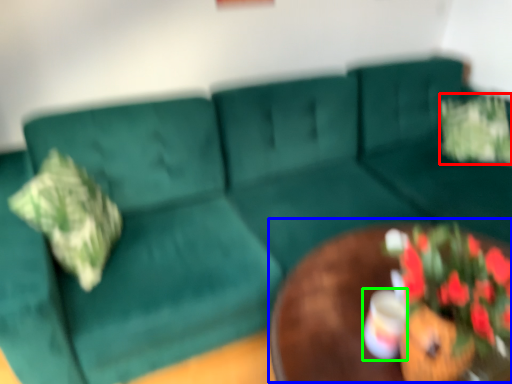
Question: Which object is positioned farthest from flower (highlighted by a red box)? Select from round table (highlighted by a blue box) and coffee cup (highlighted by a green box).

Choices:
 (A) round table
 (B) coffee cup

Answer: (B)